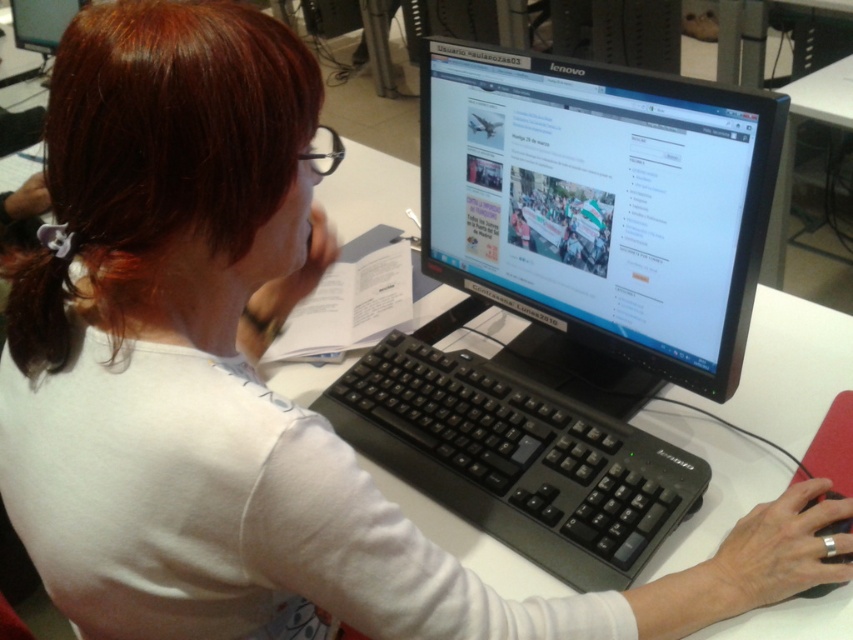
Between black plastic keyboard at center and matte black monitor at upper center, which one has less height?

matte black monitor at upper center

What do you see at coordinates (517, 458) in the screenshot?
I see `black plastic keyboard at center` at bounding box center [517, 458].

The image size is (853, 640). I want to click on black plastic keyboard at center, so click(517, 458).

Is black glossy monitor at center positioned before black plastic keyboard at center?

That is True.

Does black glossy monitor at center lie behind black plastic keyboard at center?

No, it is not.

This screenshot has height=640, width=853. I want to click on black glossy monitor at center, so click(599, 212).

In order to click on black glossy monitor at center in this screenshot , I will do `click(599, 212)`.

Can you confirm if black glossy monitor at center is positioned above matte black monitor at upper center?

No.

Who is more distant from viewer, (549, 330) or (42, 49)?

Point (42, 49)

Which is behind, point (518, 157) or point (24, 28)?

The point (24, 28) is more distant.

The image size is (853, 640). Identify the location of black glossy monitor at center. (599, 212).